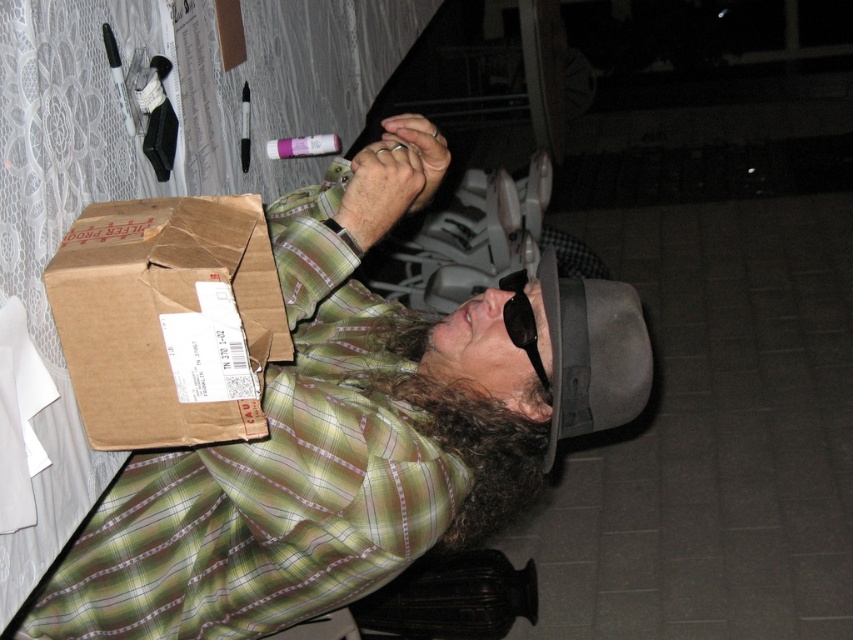
Question: Where is brown cardboard box at center located in relation to brown cardboard box at left in the image?

Choices:
 (A) above
 (B) below

Answer: (B)

Question: Which point is farther to the camera?

Choices:
 (A) (128, 477)
 (B) (137, 301)

Answer: (A)

Question: Can you confirm if brown cardboard box at center is bigger than brown cardboard box at left?

Choices:
 (A) yes
 (B) no

Answer: (A)

Question: Does brown cardboard box at center come in front of brown cardboard box at left?

Choices:
 (A) yes
 (B) no

Answer: (B)